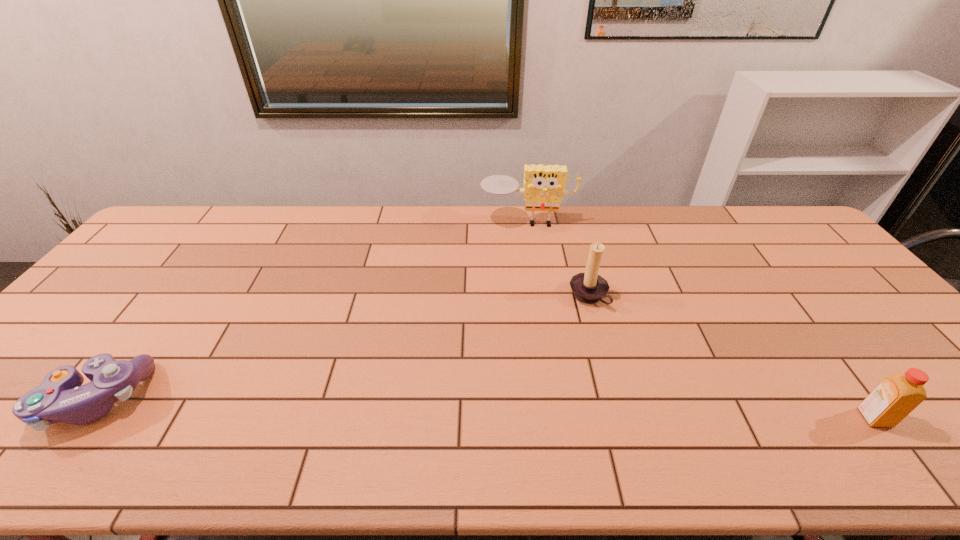
Locate an element on the screen. Image resolution: width=960 pixels, height=540 pixels. vacant space situated on the wick of the third nearest object is located at coordinates (460, 364).

Identify the location of free location located on the front-facing side of the farthest object. (528, 269).

The height and width of the screenshot is (540, 960). In order to click on free point located 0.340m on the front-facing side of the farthest object in this screenshot , I will do `click(530, 300)`.

In order to click on vacant region located 0.310m on the front-facing side of the farthest object in this screenshot , I will do (x=529, y=293).

Where is `object that is at the far edge`? The height and width of the screenshot is (540, 960). object that is at the far edge is located at coordinates (543, 190).

In order to click on control that is at the near edge in this screenshot , I will do `click(60, 397)`.

In order to click on orange juice that is at the near edge in this screenshot , I will do `click(896, 396)`.

You are a GUI agent. You are given a task and a screenshot of the screen. Output one action in this format:
    pyautogui.click(x=<x>, y=<y>)
    Task: Click on the object present at the left edge
    Image resolution: width=960 pixels, height=540 pixels.
    Given the screenshot: What is the action you would take?
    pyautogui.click(x=60, y=397)

The height and width of the screenshot is (540, 960). What are the coordinates of `object located at the near left corner` in the screenshot? It's located at (60, 397).

In the image, there is a desktop. At what (x,y) coordinates should I click in order to perform the action: click on vacant space at the far edge. Please return your answer as a coordinate pair (x, y). The image size is (960, 540). Looking at the image, I should click on (292, 205).